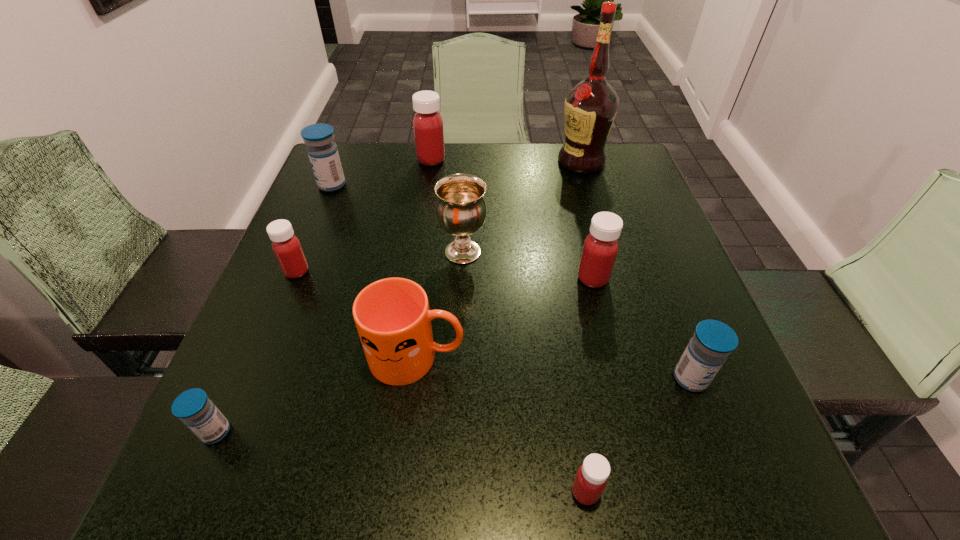
The height and width of the screenshot is (540, 960). Identify the location of the tallest object. (590, 106).

The height and width of the screenshot is (540, 960). Find the location of `brown alcohol`. brown alcohol is located at coordinates pyautogui.click(x=590, y=106).

Find the location of `the biggest red medicine`. the biggest red medicine is located at coordinates (427, 124).

At what (x,y) coordinates should I click in order to perform the action: click on the farthest medicine. Please return your answer as a coordinate pair (x, y). The width and height of the screenshot is (960, 540). Looking at the image, I should click on (427, 124).

Locate an element on the screen. This screenshot has width=960, height=540. chalice is located at coordinates (461, 208).

Where is `the farthest blue medicine`? Image resolution: width=960 pixels, height=540 pixels. the farthest blue medicine is located at coordinates (323, 154).

Where is `the sixth nearest medicine`? The height and width of the screenshot is (540, 960). the sixth nearest medicine is located at coordinates (323, 154).

This screenshot has height=540, width=960. Find the location of `the sixth medicine from left to right`. the sixth medicine from left to right is located at coordinates (600, 249).

The image size is (960, 540). Identify the location of the rightmost red medicine. (600, 249).

The image size is (960, 540). I want to click on mug, so click(392, 316).